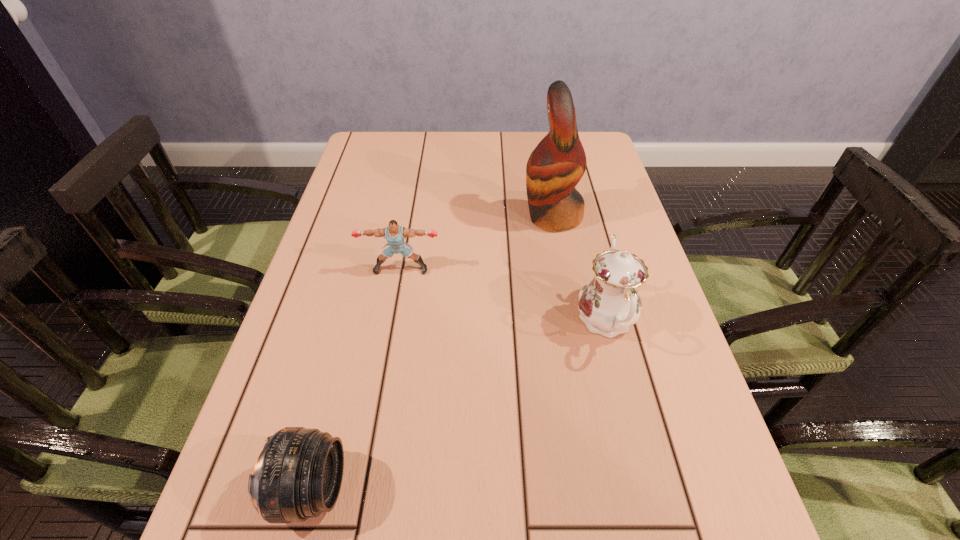
Identify the location of object that is the closest one to the puncher. This screenshot has height=540, width=960. (557, 164).

At what (x,y) coordinates should I click in order to perform the action: click on the second closest object to the farthest object. Please return your answer as a coordinate pair (x, y). Looking at the image, I should click on pos(395,234).

Locate an element on the screen. vacant area in the image that satisfies the following two spatial constraints: 1. on the face of the chinaware; 2. on the right side of the parrot is located at coordinates (571, 321).

Where is `free spot that satisfies the following two spatial constraints: 1. on the front-facing side of the second farthest object; 2. at the front element of the telephoto lens`? The height and width of the screenshot is (540, 960). free spot that satisfies the following two spatial constraints: 1. on the front-facing side of the second farthest object; 2. at the front element of the telephoto lens is located at coordinates (362, 489).

Image resolution: width=960 pixels, height=540 pixels. Find the location of `free space that satisfies the following two spatial constraints: 1. on the front side of the third farthest object; 2. at the front element of the telephoto lens`. free space that satisfies the following two spatial constraints: 1. on the front side of the third farthest object; 2. at the front element of the telephoto lens is located at coordinates (648, 489).

Find the location of a particular element. free space that satisfies the following two spatial constraints: 1. on the face of the chinaware; 2. on the left side of the farthest object is located at coordinates (571, 321).

Where is `vacant space that satisfies the following two spatial constraints: 1. on the face of the tallest object; 2. on the front-facing side of the third nearest object`? The image size is (960, 540). vacant space that satisfies the following two spatial constraints: 1. on the face of the tallest object; 2. on the front-facing side of the third nearest object is located at coordinates (562, 269).

You are a GUI agent. You are given a task and a screenshot of the screen. Output one action in this format:
    pyautogui.click(x=<x>, y=<y>)
    Task: Click on the vacant space that satisfies the following two spatial constraints: 1. on the front-facing side of the second farthest object; 2. at the front element of the telephoto lens
    This screenshot has height=540, width=960.
    Given the screenshot: What is the action you would take?
    pyautogui.click(x=362, y=489)

Locate an element on the screen. Image resolution: width=960 pixels, height=540 pixels. vacant space that satisfies the following two spatial constraints: 1. on the face of the second nearest object; 2. on the left side of the tallest object is located at coordinates (571, 321).

Where is `vacant region that satisfies the following two spatial constraints: 1. on the face of the third farthest object; 2. on the left side of the tallest object`? vacant region that satisfies the following two spatial constraints: 1. on the face of the third farthest object; 2. on the left side of the tallest object is located at coordinates (571, 321).